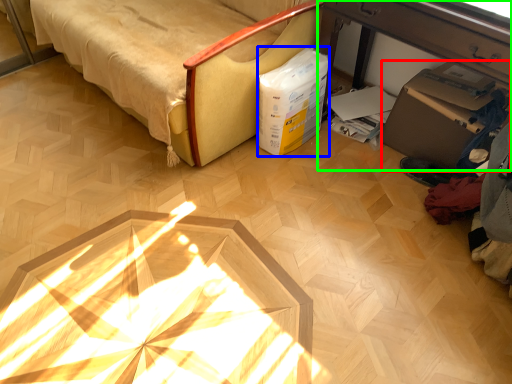
Question: Which object is positioned farthest from cardboard box (highlighted by a red box)? Select from box (highlighted by a blue box) and table (highlighted by a green box).

Choices:
 (A) box
 (B) table

Answer: (A)